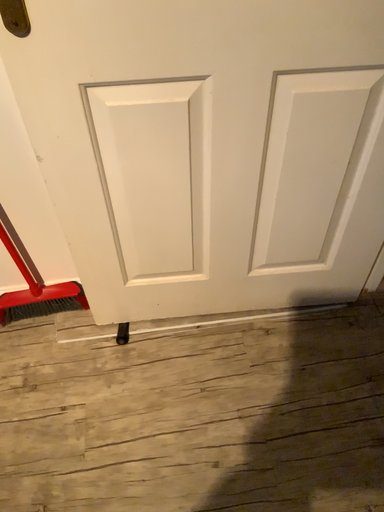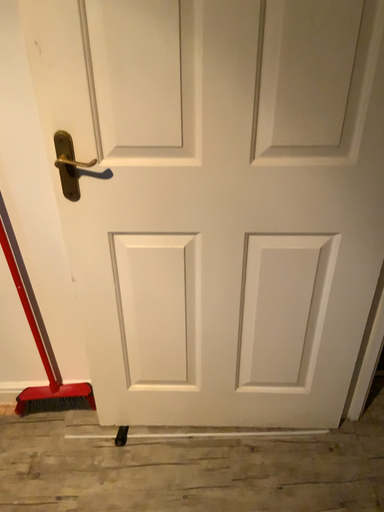
Question: How did the camera likely rotate when shooting the video?

Choices:
 (A) rotated downward
 (B) rotated upward

Answer: (B)